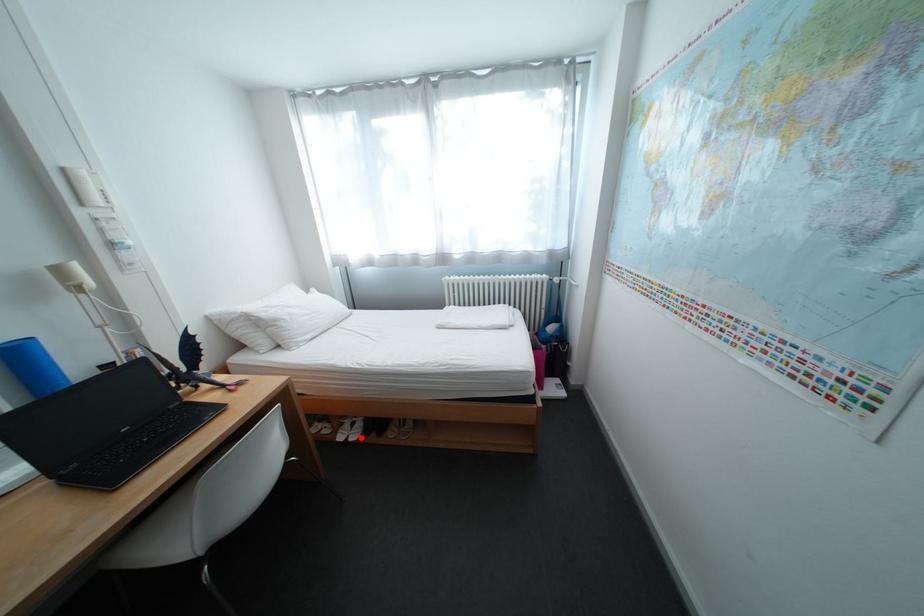
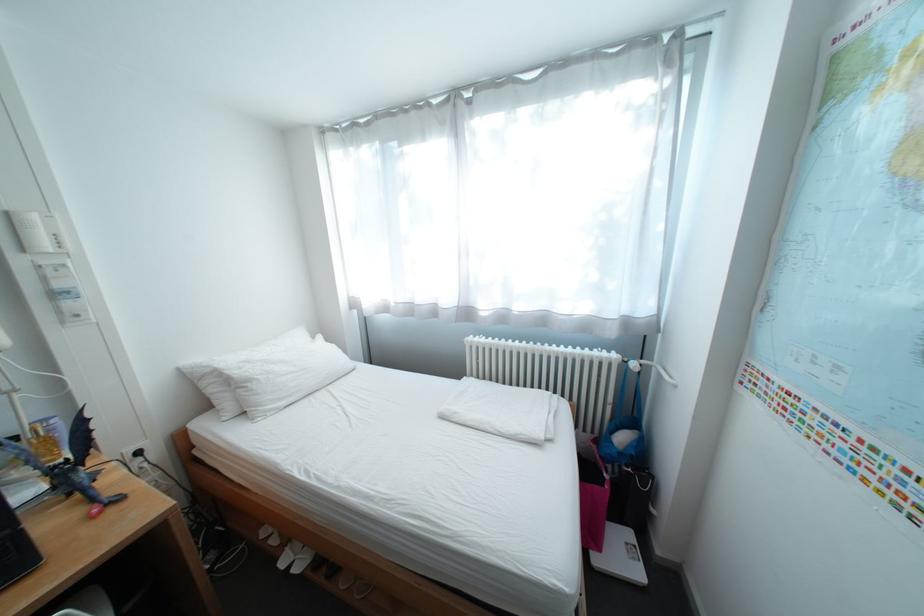
The point at the highlighted location is marked in the first image. Where is the corresponding point in the second image?

(307, 562)